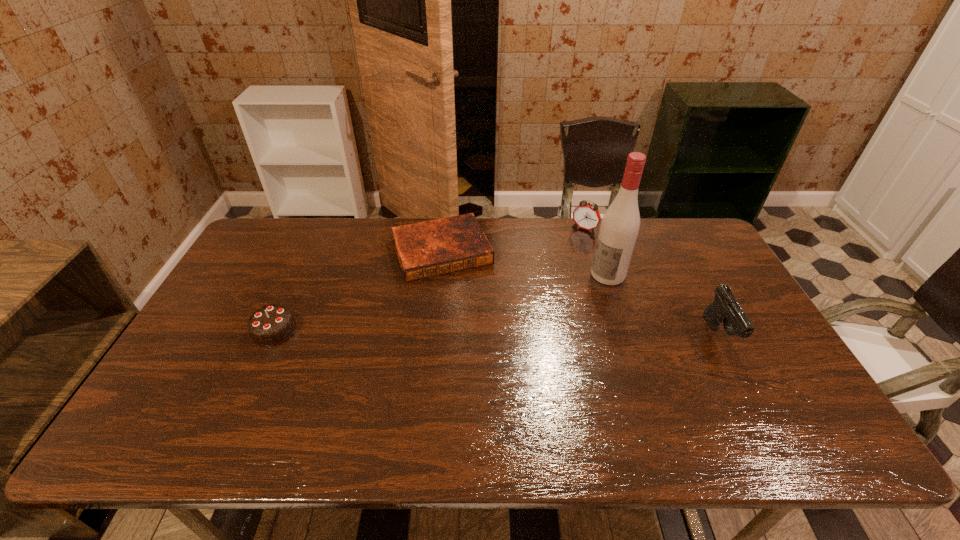
Identify the location of vacant space situated 0.400m on the label of the alcohol. (505, 349).

I want to click on vacant space positioned on the label of the alcohol, so click(x=568, y=303).

Where is `free space located on the spine side of the fourth object from right to left`? free space located on the spine side of the fourth object from right to left is located at coordinates (483, 345).

Where is `vacant space situated on the spine side of the fourth object from right to left`? This screenshot has width=960, height=540. vacant space situated on the spine side of the fourth object from right to left is located at coordinates (467, 307).

The height and width of the screenshot is (540, 960). Find the location of `vacant space located on the spine side of the fourth object from right to left`. vacant space located on the spine side of the fourth object from right to left is located at coordinates (497, 381).

In order to click on free space located 0.100m on the clock face of the alarm clock in this screenshot , I will do `click(568, 249)`.

I want to click on vacant position located on the clock face of the alarm clock, so click(571, 244).

Find the location of a particular element. vacant space located 0.230m on the clock face of the alarm clock is located at coordinates (552, 271).

I want to click on Bible at the far edge, so click(436, 247).

Identify the location of alarm clock that is at the far edge. This screenshot has height=540, width=960. (586, 216).